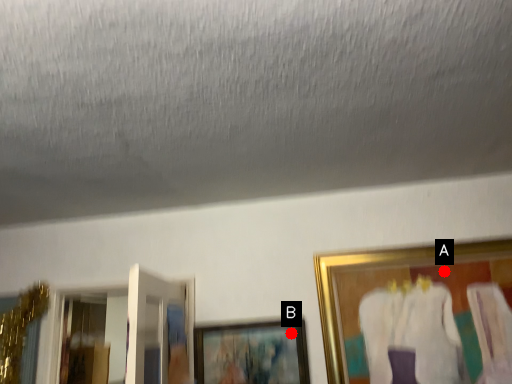
Question: Two points are circled on the image, labeled by A and B beside each circle. Which of the following is the farthest from the observer?

Choices:
 (A) A is further
 (B) B is further

Answer: (B)